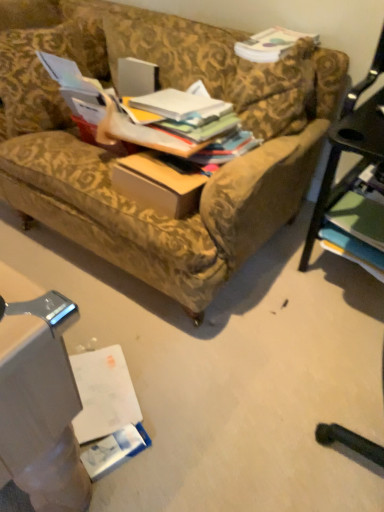
Where is `white paper book at center, the 4th book from the bottom`? white paper book at center, the 4th book from the bottom is located at coordinates (174, 103).

Describe the element at coordinates (174, 103) in the screenshot. I see `white paper book at center, the 4th book from the bottom` at that location.

Locate an element on the screen. The image size is (384, 512). multicolored paper stack at center, the fourth book when ordered from top to bottom is located at coordinates (199, 127).

What do you see at coordinates (359, 218) in the screenshot?
I see `green matte book at lower right, which appears as the fifth book when viewed from the top` at bounding box center [359, 218].

Where is `multicolored paper stack at center, the 3th book from the top`? multicolored paper stack at center, the 3th book from the top is located at coordinates (189, 137).

The height and width of the screenshot is (512, 384). Describe the element at coordinates (270, 44) in the screenshot. I see `matte white book at upper center, placed as the first book when sorted from top to bottom` at that location.

What is the approximate height of matte white book at upper center, placed as the first book when sorted from top to bottom?

The height of matte white book at upper center, placed as the first book when sorted from top to bottom, is 2.19 inches.

Locate an element on the screen. Image resolution: width=384 pixels, height=512 pixels. white paper book at center, the second book in the top-to-bottom sequence is located at coordinates (174, 103).

Based on the photo, considering the relative sizes of multicolored paper stack at center, positioned as the 2th book in bottom-to-top order, and matte white book at upper center, the 5th book from the bottom, in the image provided, is multicolored paper stack at center, positioned as the 2th book in bottom-to-top order, thinner than matte white book at upper center, the 5th book from the bottom,?

Yes.

The image size is (384, 512). What are the coordinates of `book that is the 1st one when counting rightward from the multicolored paper stack at center, positioned as the 2th book in bottom-to-top order` in the screenshot? It's located at (270, 44).

Considering the sizes of multicolored paper stack at center, positioned as the 2th book in bottom-to-top order, and matte white book at upper center, placed as the first book when sorted from top to bottom, in the image, is multicolored paper stack at center, positioned as the 2th book in bottom-to-top order, taller or shorter than matte white book at upper center, placed as the first book when sorted from top to bottom,?

multicolored paper stack at center, positioned as the 2th book in bottom-to-top order, is shorter than matte white book at upper center, placed as the first book when sorted from top to bottom.

Is multicolored paper stack at center, the fourth book when ordered from top to bottom, in front of or behind matte white book at upper center, the 5th book from the bottom, in the image?

Visually, multicolored paper stack at center, the fourth book when ordered from top to bottom, is located in front of matte white book at upper center, the 5th book from the bottom.

Image resolution: width=384 pixels, height=512 pixels. I want to click on the 1st book above the green matte book at lower right, the 1th book when ordered from bottom to top (from the image's perspective), so click(199, 127).

Is green matte book at lower right, the 1th book when ordered from bottom to top, next to multicolored paper stack at center, positioned as the 2th book in bottom-to-top order, and touching it?

They are not placed beside each other.

Is green matte book at lower right, the 1th book when ordered from bottom to top, at the right side of multicolored paper stack at center, positioned as the 2th book in bottom-to-top order?

Yes, green matte book at lower right, the 1th book when ordered from bottom to top, is to the right of multicolored paper stack at center, positioned as the 2th book in bottom-to-top order.

Which object is wider, green matte book at lower right, which appears as the fifth book when viewed from the top, or multicolored paper stack at center, the fourth book when ordered from top to bottom?

green matte book at lower right, which appears as the fifth book when viewed from the top, is wider.

In the scene shown: Is multicolored paper stack at center, the 3th book from the top, not within white paper book at center, the second book in the top-to-bottom sequence?

multicolored paper stack at center, the 3th book from the top, is positioned outside white paper book at center, the second book in the top-to-bottom sequence.

Is the surface of multicolored paper stack at center, which ranks as the 3th book in bottom-to-top order, in direct contact with white paper book at center, the second book in the top-to-bottom sequence?

Absolutely, multicolored paper stack at center, which ranks as the 3th book in bottom-to-top order, is next to and touching white paper book at center, the second book in the top-to-bottom sequence.

From a real-world perspective, count 2nd books downward from the white paper book at center, the 4th book from the bottom, and point to it. Please provide its 2D coordinates.

[(189, 137)]

Is point (179, 133) less distant than point (161, 115)?

That is True.

Could you tell me if green matte book at lower right, the 1th book when ordered from bottom to top, is facing matte white book at upper center, the 5th book from the bottom?

No, green matte book at lower right, the 1th book when ordered from bottom to top, is not facing towards matte white book at upper center, the 5th book from the bottom.

Does green matte book at lower right, which appears as the fifth book when viewed from the top, have a greater height compared to matte white book at upper center, the 5th book from the bottom?

Yes.

Considering the positions of points (353, 224) and (268, 35), is point (353, 224) closer to camera compared to point (268, 35)?

Yes.

Does green matte book at lower right, which appears as the fifth book when viewed from the top, have a greater width compared to matte white book at upper center, the 5th book from the bottom?

No, green matte book at lower right, which appears as the fifth book when viewed from the top, is not wider than matte white book at upper center, the 5th book from the bottom.

Considering the sizes of objects multicolored paper stack at center, which ranks as the 3th book in bottom-to-top order, and green matte book at lower right, which appears as the fifth book when viewed from the top, in the image provided, who is shorter, multicolored paper stack at center, which ranks as the 3th book in bottom-to-top order, or green matte book at lower right, which appears as the fifth book when viewed from the top,?

Standing shorter between the two is multicolored paper stack at center, which ranks as the 3th book in bottom-to-top order.

What's the angular difference between multicolored paper stack at center, which ranks as the 3th book in bottom-to-top order, and green matte book at lower right, which appears as the fifth book when viewed from the top,'s facing directions?

1.17 degrees separate the facing orientations of multicolored paper stack at center, which ranks as the 3th book in bottom-to-top order, and green matte book at lower right, which appears as the fifth book when viewed from the top.

Which object is wider, multicolored paper stack at center, the 3th book from the top, or green matte book at lower right, which appears as the fifth book when viewed from the top?

multicolored paper stack at center, the 3th book from the top, is wider.

From a real-world perspective, is multicolored paper stack at center, the 3th book from the top, physically located above or below green matte book at lower right, which appears as the fifth book when viewed from the top?

Clearly, from a real-world perspective, multicolored paper stack at center, the 3th book from the top, is above green matte book at lower right, which appears as the fifth book when viewed from the top.

Is multicolored paper stack at center, the 3th book from the top, behind multicolored paper stack at center, positioned as the 2th book in bottom-to-top order?

No, the depth of multicolored paper stack at center, the 3th book from the top, is less than that of multicolored paper stack at center, positioned as the 2th book in bottom-to-top order.

Considering the positions of points (143, 132) and (179, 123), is point (143, 132) closer to camera compared to point (179, 123)?

No, it is behind (179, 123).

Does multicolored paper stack at center, the 3th book from the top, have a greater height compared to multicolored paper stack at center, positioned as the 2th book in bottom-to-top order?

Correct, multicolored paper stack at center, the 3th book from the top, is much taller as multicolored paper stack at center, positioned as the 2th book in bottom-to-top order.

Is multicolored paper stack at center, positioned as the 2th book in bottom-to-top order, at the back of multicolored paper stack at center, the 3th book from the top?

No, multicolored paper stack at center, the 3th book from the top, is not facing the opposite direction of multicolored paper stack at center, positioned as the 2th book in bottom-to-top order.

Would you say matte white book at upper center, placed as the first book when sorted from top to bottom, is inside or outside green matte book at lower right, which appears as the fifth book when viewed from the top?

matte white book at upper center, placed as the first book when sorted from top to bottom, is spatially situated outside green matte book at lower right, which appears as the fifth book when viewed from the top.

From the image's perspective, starting from the matte white book at upper center, placed as the first book when sorted from top to bottom, which book is the 4th one below? Please provide its 2D coordinates.

[(359, 218)]

Is matte white book at upper center, placed as the first book when sorted from top to bottom, oriented away from green matte book at lower right, the 1th book when ordered from bottom to top?

No.

Measure the distance between matte white book at upper center, placed as the first book when sorted from top to bottom, and green matte book at lower right, the 1th book when ordered from bottom to top.

matte white book at upper center, placed as the first book when sorted from top to bottom, and green matte book at lower right, the 1th book when ordered from bottom to top, are 67.60 centimeters apart from each other.

The image size is (384, 512). I want to click on book that is the 1st object to the left of the matte white book at upper center, the 5th book from the bottom, starting at the anchor, so click(x=199, y=127).

The image size is (384, 512). Find the location of `the 2nd book behind the multicolored paper stack at center, positioned as the 2th book in bottom-to-top order, starting your count from the anchor`. the 2nd book behind the multicolored paper stack at center, positioned as the 2th book in bottom-to-top order, starting your count from the anchor is located at coordinates (359, 218).

From the image, which object appears to be farther from multicolored paper stack at center, which ranks as the 3th book in bottom-to-top order, green matte book at lower right, which appears as the fifth book when viewed from the top, or multicolored paper stack at center, positioned as the 2th book in bottom-to-top order?

The object further to multicolored paper stack at center, which ranks as the 3th book in bottom-to-top order, is green matte book at lower right, which appears as the fifth book when viewed from the top.

Which object lies further to the anchor point multicolored paper stack at center, which ranks as the 3th book in bottom-to-top order, matte white book at upper center, the 5th book from the bottom, or green matte book at lower right, the 1th book when ordered from bottom to top?

green matte book at lower right, the 1th book when ordered from bottom to top.

Looking at the image, which one is located further to green matte book at lower right, which appears as the fifth book when viewed from the top, multicolored paper stack at center, positioned as the 2th book in bottom-to-top order, or white paper book at center, the second book in the top-to-bottom sequence?

white paper book at center, the second book in the top-to-bottom sequence.

When comparing their distances from multicolored paper stack at center, the fourth book when ordered from top to bottom, does matte white book at upper center, the 5th book from the bottom, or white paper book at center, the second book in the top-to-bottom sequence, seem further?

Among the two, matte white book at upper center, the 5th book from the bottom, is located further to multicolored paper stack at center, the fourth book when ordered from top to bottom.

When comparing their distances from white paper book at center, the second book in the top-to-bottom sequence, does matte white book at upper center, the 5th book from the bottom, or multicolored paper stack at center, the fourth book when ordered from top to bottom, seem closer?

Among the two, multicolored paper stack at center, the fourth book when ordered from top to bottom, is located nearer to white paper book at center, the second book in the top-to-bottom sequence.

In the scene shown: From the image, which object appears to be nearer to white paper book at center, the second book in the top-to-bottom sequence, matte white book at upper center, placed as the first book when sorted from top to bottom, or multicolored paper stack at center, the 3th book from the top?

Based on the image, multicolored paper stack at center, the 3th book from the top, appears to be nearer to white paper book at center, the second book in the top-to-bottom sequence.

When comparing their distances from white paper book at center, the 4th book from the bottom, does multicolored paper stack at center, the 3th book from the top, or multicolored paper stack at center, positioned as the 2th book in bottom-to-top order, seem closer?

multicolored paper stack at center, positioned as the 2th book in bottom-to-top order, is closer to white paper book at center, the 4th book from the bottom.

Based on their spatial positions, is white paper book at center, the second book in the top-to-bottom sequence, or green matte book at lower right, which appears as the fifth book when viewed from the top, further from matte white book at upper center, the 5th book from the bottom?

green matte book at lower right, which appears as the fifth book when viewed from the top, is positioned further to the anchor matte white book at upper center, the 5th book from the bottom.

The height and width of the screenshot is (512, 384). Find the location of `book between multicolored paper stack at center, the 3th book from the top, and matte white book at upper center, placed as the first book when sorted from top to bottom, from left to right`. book between multicolored paper stack at center, the 3th book from the top, and matte white book at upper center, placed as the first book when sorted from top to bottom, from left to right is located at coordinates (199, 127).

I want to click on book between white paper book at center, the 4th book from the bottom, and multicolored paper stack at center, positioned as the 2th book in bottom-to-top order, so click(189, 137).